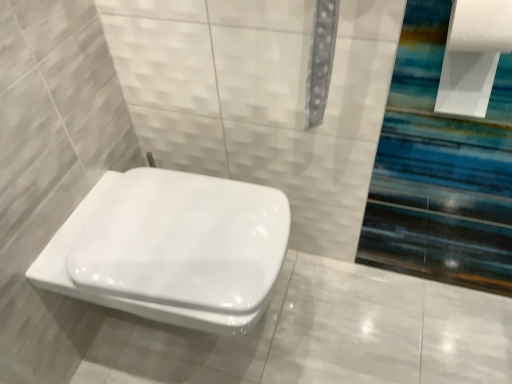
You are a GUI agent. You are given a task and a screenshot of the screen. Output one action in this format:
    pyautogui.click(x=<x>, y=<y>)
    Task: Click on the vacant area to the right of white glossy toilet at center
    
    Given the screenshot: What is the action you would take?
    pyautogui.click(x=349, y=318)